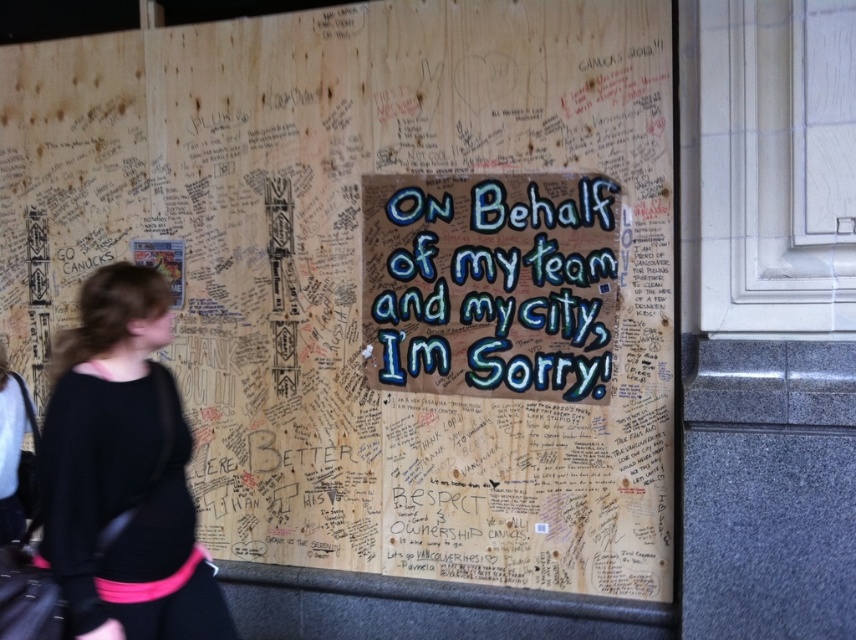
Question: Which point is closer to the camera taking this photo?

Choices:
 (A) (414, 364)
 (B) (63, 442)

Answer: (B)

Question: Can you confirm if blue painted wood sign at center is positioned above black sweater at left?

Choices:
 (A) no
 (B) yes

Answer: (B)

Question: Does blue painted wood sign at center appear under black sweater at left?

Choices:
 (A) no
 (B) yes

Answer: (A)

Question: Which point is farther to the camera?

Choices:
 (A) blue painted wood sign at center
 (B) black sweater at left

Answer: (A)

Question: Which of the following is the closest to the observer?

Choices:
 (A) black sweater at left
 (B) blue painted wood sign at center

Answer: (A)

Question: Can you confirm if blue painted wood sign at center is positioned below black sweater at left?

Choices:
 (A) yes
 (B) no

Answer: (B)